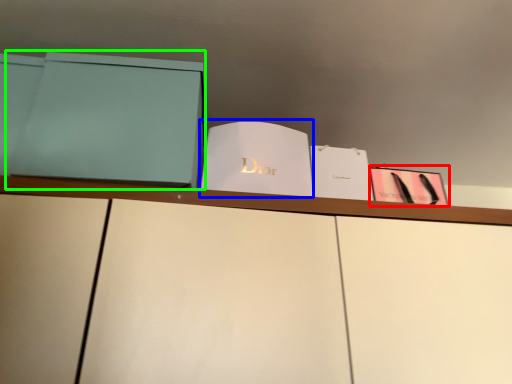
Question: Which is farther away from paperback book (highlighted by a red box)? paperback book (highlighted by a blue box) or paperback book (highlighted by a green box)?

Choices:
 (A) paperback book
 (B) paperback book

Answer: (B)